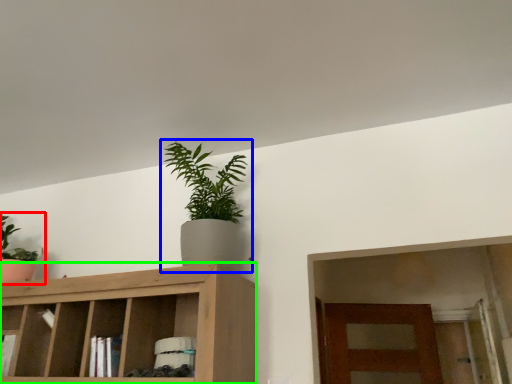
Question: Which object is the farthest from houseplant (highlighted by a red box)? Choose among these: houseplant (highlighted by a blue box) or cabinetry (highlighted by a green box).

Choices:
 (A) houseplant
 (B) cabinetry

Answer: (A)